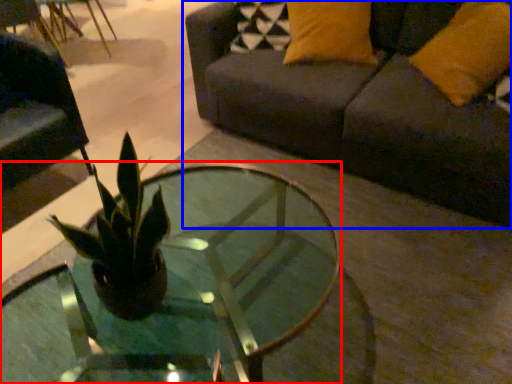
Question: Which of the following is the closest to the observer, coffee table (highlighted by a red box) or studio couch (highlighted by a blue box)?

Choices:
 (A) coffee table
 (B) studio couch

Answer: (A)